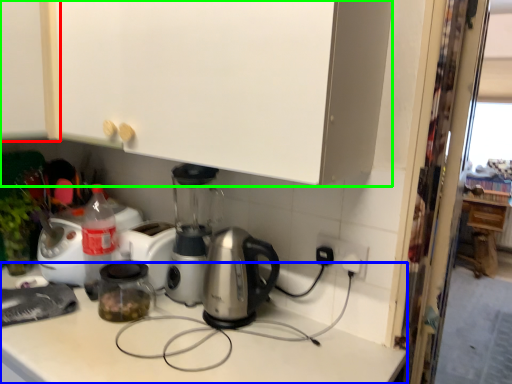
Question: Considering the real-world distances, which object is farthest from cabinetry (highlighted by a red box)? counter top (highlighted by a blue box) or cabinetry (highlighted by a green box)?

Choices:
 (A) counter top
 (B) cabinetry

Answer: (A)